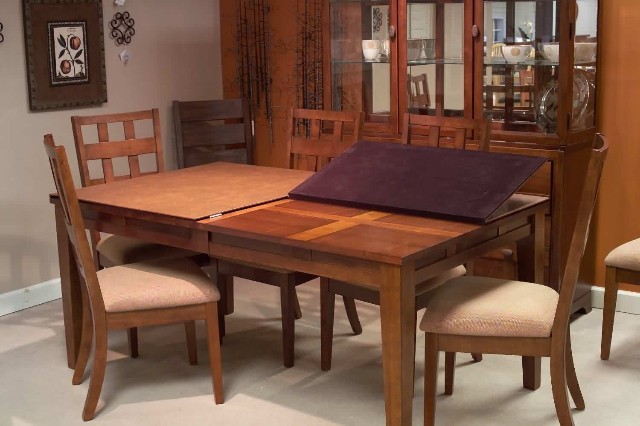
Locate an element on the screen. wall art is located at coordinates (74, 59), (58, 100).